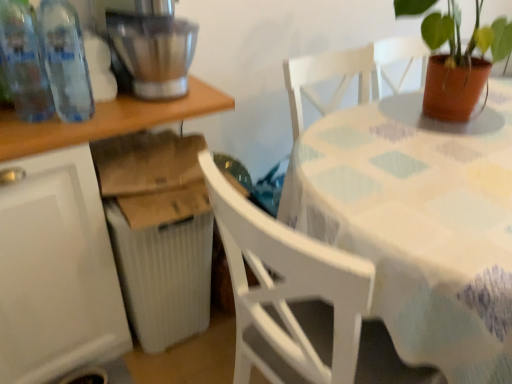
Question: In terms of height, does white plastic table at lower left, placed as the first table when sorted from left to right, look taller or shorter compared to transparent plastic bottles at left, the second bottle positioned from the left?

Choices:
 (A) tall
 (B) short

Answer: (A)

Question: Is white plastic table at lower left, placed as the first table when sorted from left to right, inside or outside of transparent plastic bottles at left, which is counted as the first bottle, starting from the right?

Choices:
 (A) outside
 (B) inside

Answer: (A)

Question: Estimate the real-world distances between objects in this image. Which object is closer to the transparent plastic bottles at left, placed as the 1th bottle when sorted from left to right?

Choices:
 (A) white ribbed radiator at lower left
 (B) terracotta pot at table
 (C) transparent plastic bottles at left, the second bottle positioned from the left
 (D) brushed metal mixer at upper left
 (E) white plastic table at lower left, positioned as the second table in right-to-left order

Answer: (C)

Question: Considering the real-world distances, which object is farthest from the transparent plastic bottles at left, the second bottle positioned from the left?

Choices:
 (A) white ribbed radiator at lower left
 (B) white plastic table at lower left, placed as the first table when sorted from left to right
 (C) white fabric-covered table at center, the 1th table when ordered from right to left
 (D) brushed metal mixer at upper left
 (E) transparent plastic bottles at left, placed as the 1th bottle when sorted from left to right

Answer: (C)